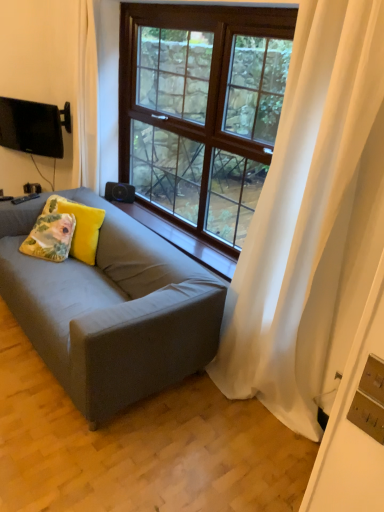
Image resolution: width=384 pixels, height=512 pixels. What do you see at coordinates (312, 222) in the screenshot?
I see `white sheer curtain at right` at bounding box center [312, 222].

Locate an element on the screen. matte gray couch at center is located at coordinates (111, 309).

The height and width of the screenshot is (512, 384). Describe the element at coordinates (111, 309) in the screenshot. I see `matte gray couch at center` at that location.

The image size is (384, 512). What are the coordinates of `white sheer curtain at right` in the screenshot? It's located at (312, 222).

From a real-world perspective, who is located higher, floral fabric pillow at left, acting as the 1th pillow starting from the left, or floral fabric cushion at center, which ranks as the 2th pillow in left-to-right order?

In real-world perspective, floral fabric cushion at center, which ranks as the 2th pillow in left-to-right order, is above.

In the scene shown: How different are the orientations of floral fabric pillow at left, acting as the 1th pillow starting from the left, and floral fabric cushion at center, which ranks as the 2th pillow in left-to-right order, in degrees?

They differ by 8.48 degrees in their facing directions.

Considering the relative positions of floral fabric pillow at left, the 2th pillow when ordered from right to left, and floral fabric cushion at center, the first pillow in the right-to-left sequence, in the image provided, is floral fabric pillow at left, the 2th pillow when ordered from right to left, to the left of floral fabric cushion at center, the first pillow in the right-to-left sequence, from the viewer's perspective?

Yes.

This screenshot has width=384, height=512. I want to click on pillow above the floral fabric pillow at left, the 2th pillow when ordered from right to left (from the image's perspective), so click(x=79, y=226).

Can you tell me how much white sheer curtain at right and brown wooden window at center differ in facing direction?

0.0733 degrees separate the facing orientations of white sheer curtain at right and brown wooden window at center.

Which is further, [283,326] or [258,92]?

The point [258,92] is farther.

Is white sheer curtain at right facing towards brown wooden window at center?

No, white sheer curtain at right is not aimed at brown wooden window at center.

Can you confirm if white sheer curtain at right is smaller than brown wooden window at center?

Incorrect, white sheer curtain at right is not smaller in size than brown wooden window at center.

Which is correct: matte gray couch at center is inside floral fabric pillow at left, acting as the 1th pillow starting from the left, or outside of it?

matte gray couch at center lies outside floral fabric pillow at left, acting as the 1th pillow starting from the left.

Is matte gray couch at center directly adjacent to floral fabric pillow at left, the 2th pillow when ordered from right to left?

No.

Would you say matte gray couch at center is to the left or to the right of floral fabric pillow at left, acting as the 1th pillow starting from the left, in the picture?

Clearly, matte gray couch at center is on the right of floral fabric pillow at left, acting as the 1th pillow starting from the left, in the image.

Considering the sizes of matte gray couch at center and floral fabric pillow at left, the 2th pillow when ordered from right to left, in the image, is matte gray couch at center taller or shorter than floral fabric pillow at left, the 2th pillow when ordered from right to left,?

Clearly, matte gray couch at center is taller compared to floral fabric pillow at left, the 2th pillow when ordered from right to left.

From a real-world perspective, is matte gray couch at center physically located above or below wooden at center?

matte gray couch at center is situated lower than wooden at center in the real world.

Would you consider matte gray couch at center to be distant from wooden at center?

That's not correct — matte gray couch at center is a little close to wooden at center.

Is there a large distance between brown wooden window at center and matte black tv at upper left?

Yes, brown wooden window at center is far from matte black tv at upper left.

Is brown wooden window at center oriented away from matte black tv at upper left?

No.

Considering the positions of objects brown wooden window at center and matte black tv at upper left in the image provided, who is in front, brown wooden window at center or matte black tv at upper left?

brown wooden window at center is more forward.

Considering the sizes of objects brown wooden window at center and matte black tv at upper left in the image provided, who is bigger, brown wooden window at center or matte black tv at upper left?

brown wooden window at center is bigger.

Does point (30, 124) appear closer or farther from the camera than point (274, 294)?

Point (30, 124) is positioned farther from the camera compared to point (274, 294).

Which object is wider, matte black tv at upper left or white sheer curtain at right?

Wider between the two is white sheer curtain at right.

Are matte black tv at upper left and white sheer curtain at right beside each other?

matte black tv at upper left and white sheer curtain at right are clearly separated.

Is floral fabric pillow at left, acting as the 1th pillow starting from the left, wider than white sheer curtain at right?

Yes, floral fabric pillow at left, acting as the 1th pillow starting from the left, is wider than white sheer curtain at right.

Considering the positions of objects floral fabric pillow at left, the 2th pillow when ordered from right to left, and white sheer curtain at right in the image provided, who is behind, floral fabric pillow at left, the 2th pillow when ordered from right to left, or white sheer curtain at right?

floral fabric pillow at left, the 2th pillow when ordered from right to left, is more distant.

How different are the orientations of floral fabric pillow at left, acting as the 1th pillow starting from the left, and white sheer curtain at right in degrees?

floral fabric pillow at left, acting as the 1th pillow starting from the left, and white sheer curtain at right are facing 33.9 degrees away from each other.

From their relative heights in the image, would you say floral fabric pillow at left, acting as the 1th pillow starting from the left, is taller or shorter than white sheer curtain at right?

Considering their sizes, floral fabric pillow at left, acting as the 1th pillow starting from the left, has less height than white sheer curtain at right.

The width and height of the screenshot is (384, 512). What are the coordinates of `pillow below the floral fabric cushion at center, which ranks as the 2th pillow in left-to-right order (from the image's perspective)` in the screenshot? It's located at (50, 237).

Find the location of a particular element. This screenshot has width=384, height=512. window that is behind the white sheer curtain at right is located at coordinates (202, 109).

When comparing their distances from matte black tv at upper left, does brown wooden window at center or matte gray couch at center seem further?

Among the two, matte gray couch at center is located further to matte black tv at upper left.

Looking at the image, which one is located further to matte black tv at upper left, brown wooden window at center or floral fabric cushion at center, which ranks as the 2th pillow in left-to-right order?

Based on the image, brown wooden window at center appears to be further to matte black tv at upper left.

Looking at this image, considering their positions, is white sheer curtain at right positioned further to floral fabric pillow at left, the 2th pillow when ordered from right to left, than floral fabric cushion at center, which ranks as the 2th pillow in left-to-right order?

white sheer curtain at right is further to floral fabric pillow at left, the 2th pillow when ordered from right to left.

Which object lies nearer to the anchor point brown wooden window at center, white sheer curtain at right or floral fabric cushion at center, the first pillow in the right-to-left sequence?

floral fabric cushion at center, the first pillow in the right-to-left sequence.

From the image, which object appears to be nearer to wooden at center, white sheer curtain at right or floral fabric cushion at center, which ranks as the 2th pillow in left-to-right order?

floral fabric cushion at center, which ranks as the 2th pillow in left-to-right order, is closer to wooden at center.

Which object lies nearer to the anchor point floral fabric cushion at center, which ranks as the 2th pillow in left-to-right order, brown wooden window at center or wooden at center?

Among the two, wooden at center is located nearer to floral fabric cushion at center, which ranks as the 2th pillow in left-to-right order.

Based on their spatial positions, is brown wooden window at center or wooden at center further from matte gray couch at center?

The object further to matte gray couch at center is brown wooden window at center.

From the image, which object appears to be nearer to brown wooden window at center, matte gray couch at center or wooden at center?

wooden at center.

Identify the location of studio couch positioned between white sheer curtain at right and matte black tv at upper left from near to far. (111, 309).

The image size is (384, 512). Identify the location of window between white sheer curtain at right and floral fabric cushion at center, which ranks as the 2th pillow in left-to-right order, from front to back. (202, 109).

Locate an element on the screen. studio couch situated between floral fabric pillow at left, acting as the 1th pillow starting from the left, and white sheer curtain at right from left to right is located at coordinates (111, 309).

Image resolution: width=384 pixels, height=512 pixels. I want to click on window sill between matte gray couch at center and floral fabric pillow at left, acting as the 1th pillow starting from the left, from front to back, so click(182, 240).